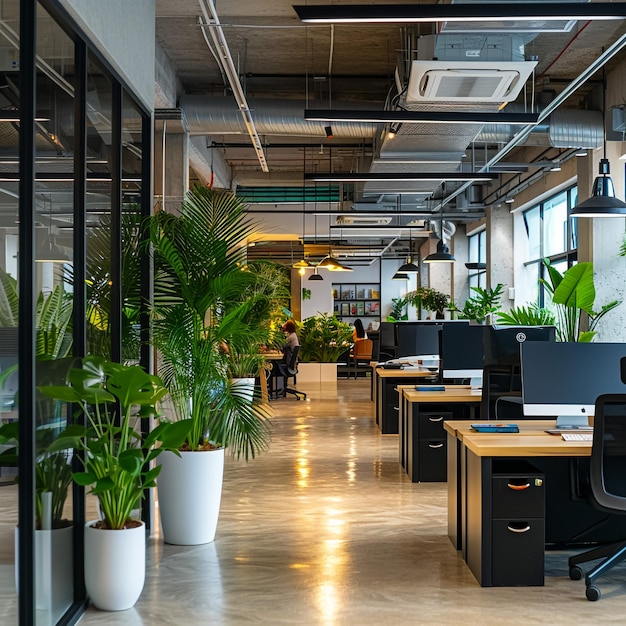
Where is `glass wall separating the different offices`? Image resolution: width=626 pixels, height=626 pixels. glass wall separating the different offices is located at coordinates (48, 283), (104, 193).